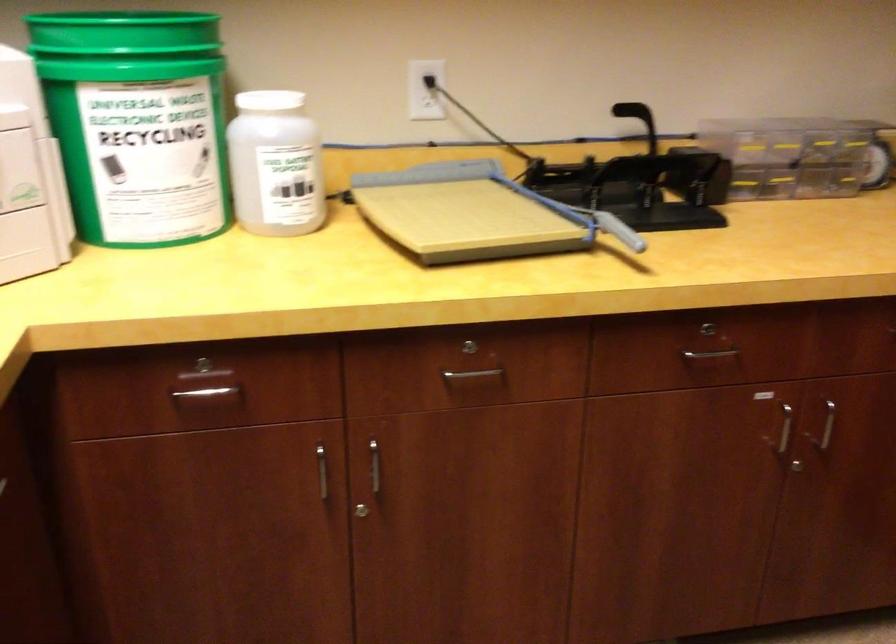
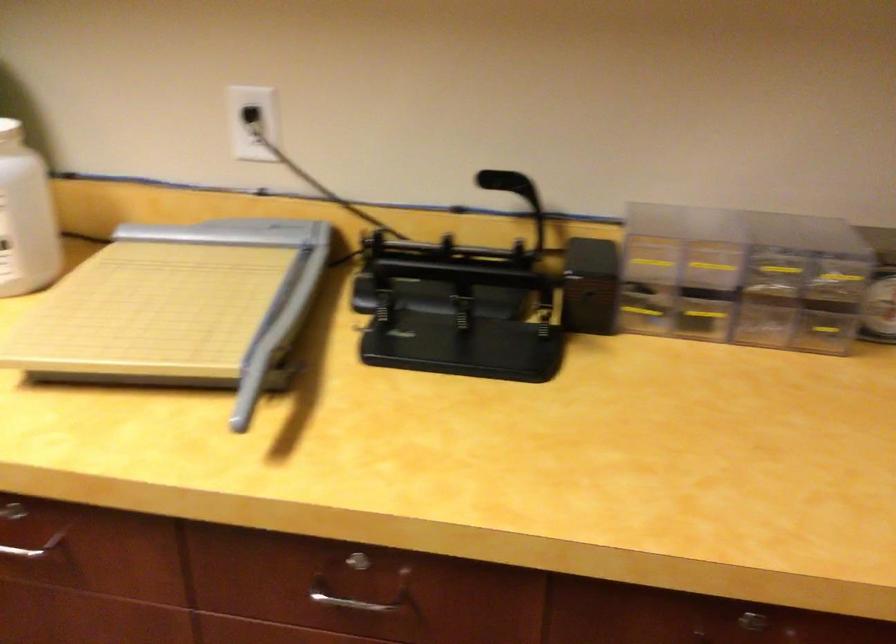
In the second image, find the point that corresponds to point 323,169 in the first image.

(26, 218)